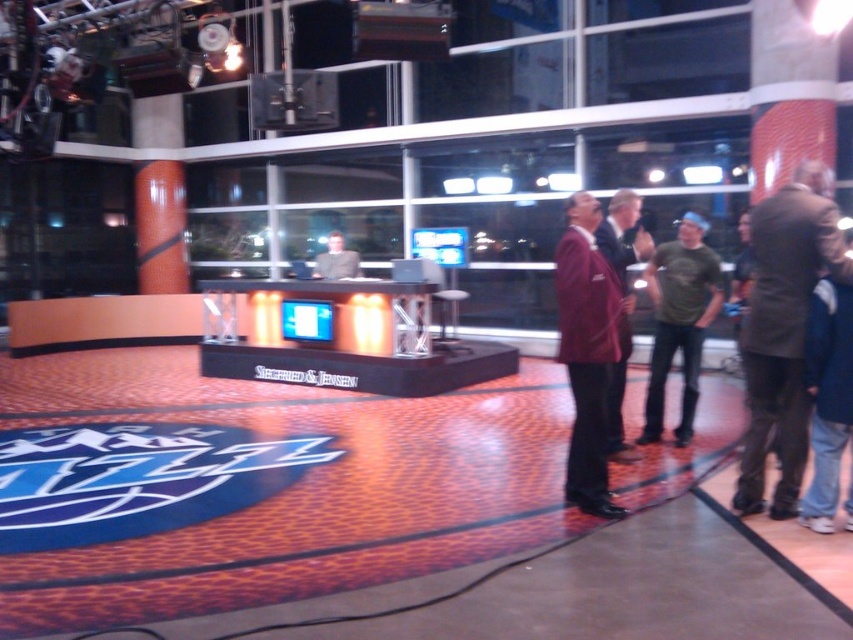
Can you confirm if maroon fabric suit at right is shorter than matte gray suit at center?

In fact, maroon fabric suit at right may be taller than matte gray suit at center.

Does maroon fabric suit at right appear on the right side of matte gray suit at center?

Correct, you'll find maroon fabric suit at right to the right of matte gray suit at center.

Identify the location of maroon fabric suit at right. The width and height of the screenshot is (853, 640). click(587, 353).

This screenshot has height=640, width=853. In order to click on maroon fabric suit at right in this screenshot , I will do `click(587, 353)`.

Is maroon wool suit at center positioned behind matte gray suit at center?

No, maroon wool suit at center is in front of matte gray suit at center.

Which is above, maroon wool suit at center or matte gray suit at center?

matte gray suit at center

Is point (625, 224) less distant than point (321, 266)?

Yes, point (625, 224) is in front of point (321, 266).

This screenshot has height=640, width=853. In order to click on maroon wool suit at center in this screenshot , I will do `click(624, 301)`.

Is the position of dark brown leather jacket at right less distant than that of green matte t-shirt at center?

Yes, it is in front of green matte t-shirt at center.

At what (x,y) coordinates should I click in order to perform the action: click on dark brown leather jacket at right. Please return your answer as a coordinate pair (x, y). Looking at the image, I should click on (784, 330).